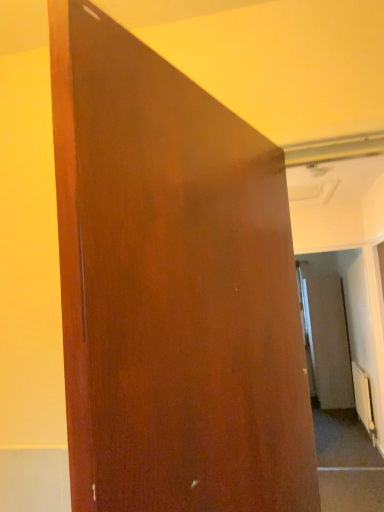
The width and height of the screenshot is (384, 512). What do you see at coordinates (364, 399) in the screenshot? I see `white metallic radiator at lower right` at bounding box center [364, 399].

In order to face matte brown screen door at right, should I rotate leftwards or rightwards?

You should rotate right by 17.856 degrees.

What do you see at coordinates (328, 340) in the screenshot? The width and height of the screenshot is (384, 512). I see `matte brown screen door at right` at bounding box center [328, 340].

Describe the element at coordinates (172, 288) in the screenshot. I see `matte wood door at center` at that location.

Locate an element on the screen. white metallic radiator at lower right is located at coordinates (364, 399).

Would you say white metallic radiator at lower right is a long distance from matte wood door at center?

Absolutely, white metallic radiator at lower right is distant from matte wood door at center.

From the image's perspective, between white metallic radiator at lower right and matte wood door at center, who is located below?

From the image's view, white metallic radiator at lower right is below.

From a real-world perspective, between white metallic radiator at lower right and matte wood door at center, who is vertically lower?

In real-world perspective, white metallic radiator at lower right is lower.

Is white metallic radiator at lower right shorter than matte wood door at center?

Indeed, white metallic radiator at lower right has a lesser height compared to matte wood door at center.

Between matte wood door at center and matte brown screen door at right, which one appears on the left side from the viewer's perspective?

Positioned to the left is matte wood door at center.

Identify the location of screen door on the right of the matte wood door at center. The height and width of the screenshot is (512, 384). (328, 340).

Is matte wood door at center placed right next to matte brown screen door at right?

matte wood door at center and matte brown screen door at right are not in contact.

Considering the positions of objects matte brown screen door at right and white metallic radiator at lower right in the image provided, who is more to the left, matte brown screen door at right or white metallic radiator at lower right?

white metallic radiator at lower right is more to the left.

Looking at this image, is matte brown screen door at right not near white metallic radiator at lower right?

No.

How many degrees apart are the facing directions of matte brown screen door at right and white metallic radiator at lower right?

matte brown screen door at right and white metallic radiator at lower right are facing 0.628 degrees away from each other.

Between matte wood door at center and white metallic radiator at lower right, which one has more height?

matte wood door at center is taller.

Considering the relative positions of matte wood door at center and white metallic radiator at lower right in the image provided, is matte wood door at center to the right of white metallic radiator at lower right from the viewer's perspective?

Incorrect, matte wood door at center is not on the right side of white metallic radiator at lower right.

Is matte wood door at center bigger than white metallic radiator at lower right?

Yes.

How many degrees apart are the facing directions of white metallic radiator at lower right and matte brown screen door at right?

The angular difference between white metallic radiator at lower right and matte brown screen door at right is 0.628 degrees.

Considering the positions of objects white metallic radiator at lower right and matte brown screen door at right in the image provided, who is more to the right, white metallic radiator at lower right or matte brown screen door at right?

matte brown screen door at right is more to the right.

Where is `screen door above the white metallic radiator at lower right (from the image's perspective)`? The image size is (384, 512). screen door above the white metallic radiator at lower right (from the image's perspective) is located at coordinates (328, 340).

Does white metallic radiator at lower right have a smaller size compared to matte brown screen door at right?

Correct, white metallic radiator at lower right occupies less space than matte brown screen door at right.

From a real-world perspective, is matte brown screen door at right beneath matte wood door at center?

Yes, from a real-world perspective, matte brown screen door at right is under matte wood door at center.

Is matte brown screen door at right at the right side of matte wood door at center?

Yes.

Is matte brown screen door at right wider than matte wood door at center?

Indeed, matte brown screen door at right has a greater width compared to matte wood door at center.

Is matte brown screen door at right oriented away from matte wood door at center?

No, matte wood door at center is not at the back of matte brown screen door at right.

At what (x,y) coordinates should I click in order to perform the action: click on radiator below the matte wood door at center (from a real-world perspective). Please return your answer as a coordinate pair (x, y). The image size is (384, 512). Looking at the image, I should click on (364, 399).

Locate an element on the screen. Image resolution: width=384 pixels, height=512 pixels. screen door on the right side of matte wood door at center is located at coordinates (328, 340).

From the image, which object appears to be nearer to matte wood door at center, matte brown screen door at right or white metallic radiator at lower right?

Based on the image, white metallic radiator at lower right appears to be nearer to matte wood door at center.

Consider the image. Based on their spatial positions, is matte wood door at center or matte brown screen door at right further from white metallic radiator at lower right?

matte wood door at center is further to white metallic radiator at lower right.

From the image, which object appears to be nearer to matte brown screen door at right, matte wood door at center or white metallic radiator at lower right?

The object closer to matte brown screen door at right is white metallic radiator at lower right.

Estimate the real-world distances between objects in this image. Which object is closer to matte brown screen door at right, white metallic radiator at lower right or matte wood door at center?

white metallic radiator at lower right is closer to matte brown screen door at right.

Considering their positions, is white metallic radiator at lower right positioned closer to matte wood door at center than matte brown screen door at right?

white metallic radiator at lower right lies closer to matte wood door at center than the other object.

Estimate the real-world distances between objects in this image. Which object is closer to white metallic radiator at lower right, matte brown screen door at right or matte wood door at center?

matte brown screen door at right lies closer to white metallic radiator at lower right than the other object.

The width and height of the screenshot is (384, 512). I want to click on radiator located between matte wood door at center and matte brown screen door at right in the depth direction, so click(x=364, y=399).